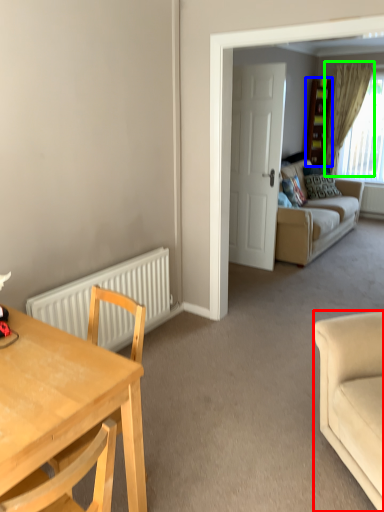
Question: Based on their relative distances, which object is farther from studio couch (highlighted by a red box)? Choose from cabinetry (highlighted by a blue box) and curtain (highlighted by a green box).

Choices:
 (A) cabinetry
 (B) curtain

Answer: (A)